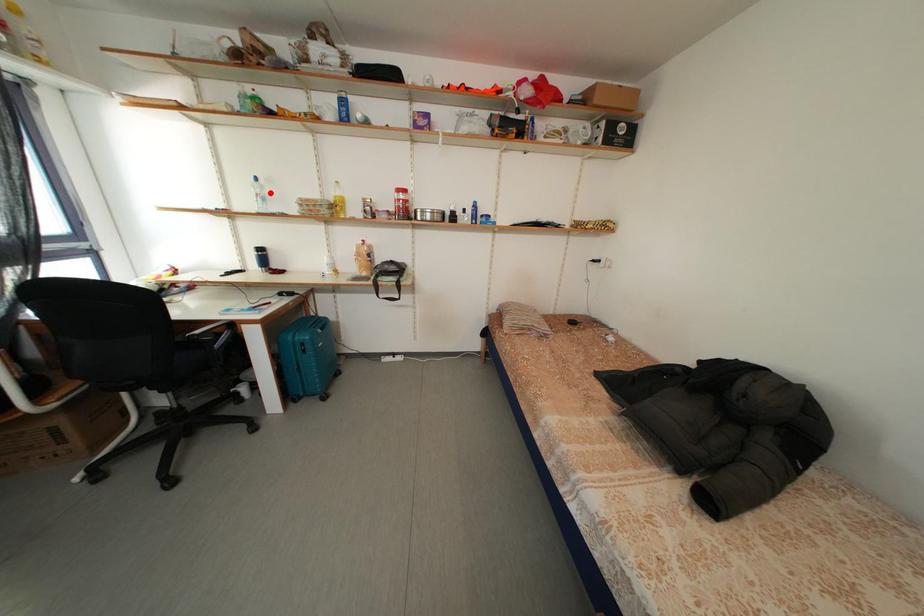
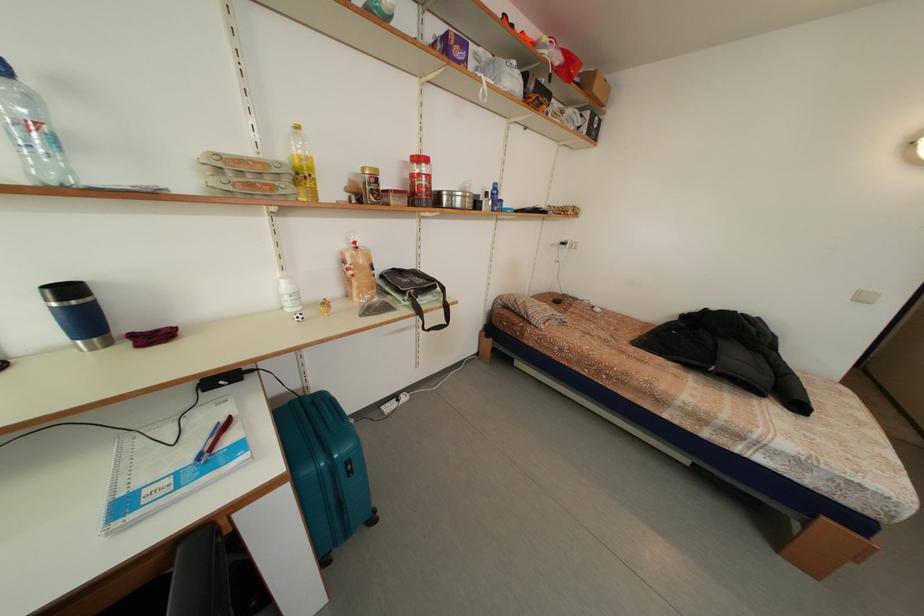
Question: I am providing you with two images of the same scene from different viewpoints. A red point is shown in image1. For the corresponding object point in image2, is it positioned nearer or farther from the camera?

Choices:
 (A) Nearer
 (B) Farther

Answer: (B)